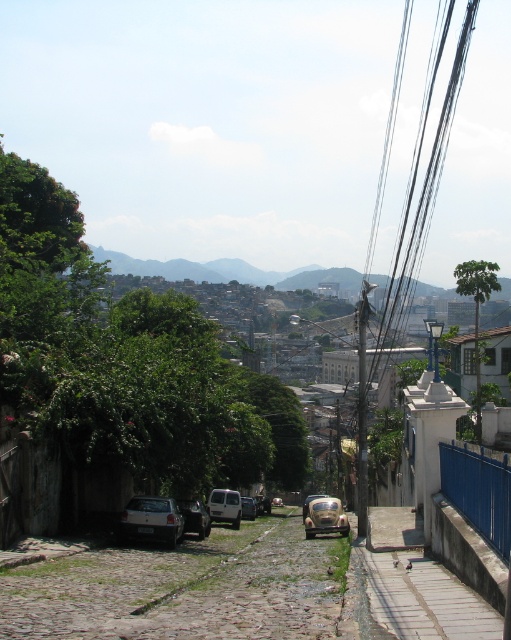
You are a photographer standing at the top of the cobblestone street. You want to position your camera so that the black wire at upper right is centered in your shot. Which direction should you move your camera to achieve this?

The black wire at upper right is located at coordinates 0.277 on the x axis and 0.830 on the y axis. To center it, move the camera slightly to the left and down.

You are standing on the cobblestone street and looking towards the white wall with a blue fence. There are two points marked on the ground in front of you. The first point is at coordinates point (159,518) and the second is at point (309,493). Which point is closer to you?

Point (159,518) is closer to the viewer than point (309,493).

You are standing at the top of the cobblestone street and want to locate the metallic silver car at center. According to the coordinates provided, where would you find it?

The metallic silver car at center is located at coordinates point (195, 516).